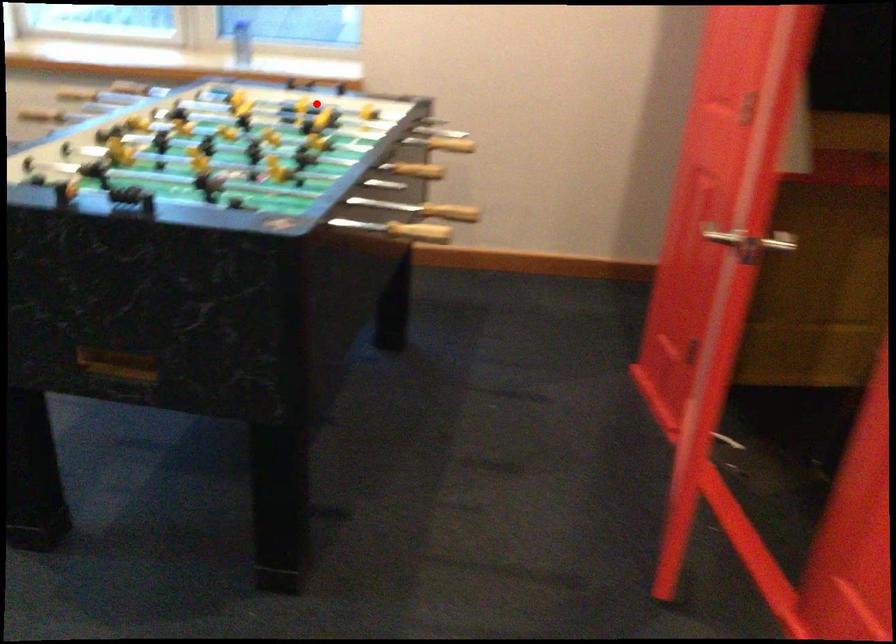
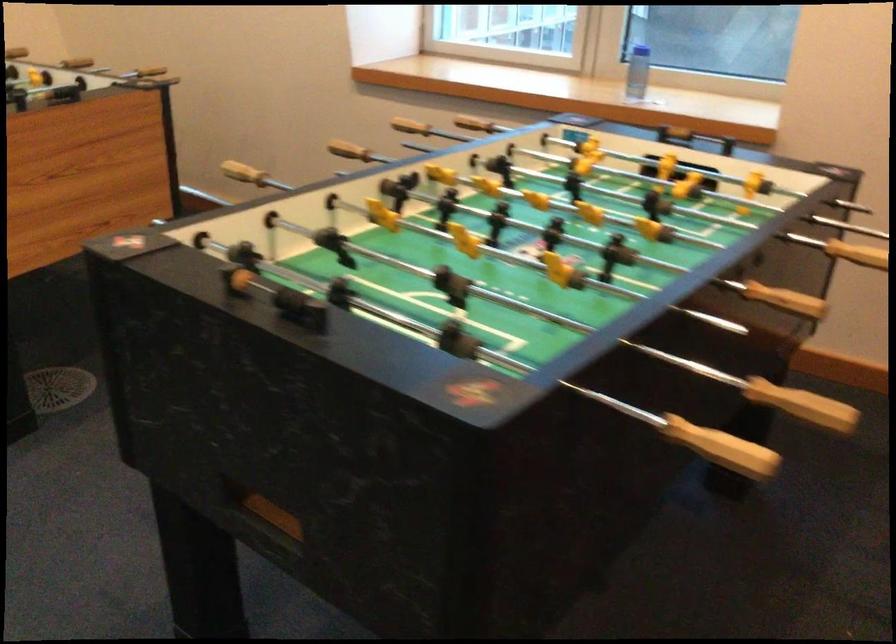
In the second image, find the point that corresponds to the highlighted location in the first image.

(678, 172)